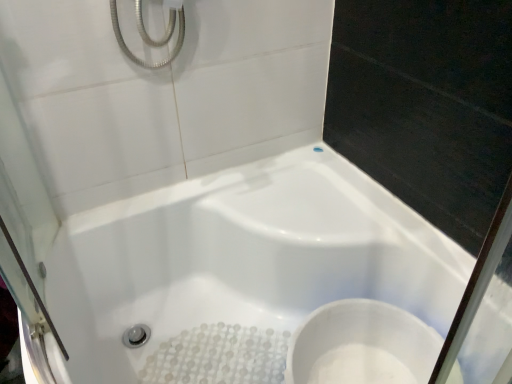
I want to click on white glossy toilet at lower right, so click(x=362, y=345).

Image resolution: width=512 pixels, height=384 pixels. Describe the element at coordinates (362, 345) in the screenshot. I see `white glossy toilet at lower right` at that location.

Locate an element on the screen. This screenshot has height=384, width=512. white glossy bathtub at center is located at coordinates (240, 260).

The height and width of the screenshot is (384, 512). What do you see at coordinates (240, 260) in the screenshot?
I see `white glossy bathtub at center` at bounding box center [240, 260].

In order to click on white glossy toilet at lower right in this screenshot , I will do `click(362, 345)`.

In the image, is white glossy toilet at lower right on the left side or the right side of white glossy bathtub at center?

white glossy toilet at lower right is to the right of white glossy bathtub at center.

Is white glossy toilet at lower right in front of or behind white glossy bathtub at center in the image?

Clearly, white glossy toilet at lower right is behind white glossy bathtub at center.

Considering the points (330, 362) and (298, 159), which point is behind, point (330, 362) or point (298, 159)?

Positioned behind is point (298, 159).

From the image's perspective, which is below, white glossy toilet at lower right or white glossy bathtub at center?

→ white glossy toilet at lower right appears lower in the image.

From a real-world perspective, is white glossy toilet at lower right physically located above or below white glossy bathtub at center?

Clearly, from a real-world perspective, white glossy toilet at lower right is above white glossy bathtub at center.

Based on the photo, considering the sizes of objects white glossy toilet at lower right and white glossy bathtub at center in the image provided, who is thinner, white glossy toilet at lower right or white glossy bathtub at center?

Thinner between the two is white glossy toilet at lower right.

Between white glossy toilet at lower right and white glossy bathtub at center, which one has more height?

Standing taller between the two is white glossy bathtub at center.

Considering the relative sizes of white glossy toilet at lower right and white glossy bathtub at center in the image provided, is white glossy toilet at lower right smaller than white glossy bathtub at center?

Yes.

From the picture: Is white glossy toilet at lower right located outside white glossy bathtub at center?

No, white glossy toilet at lower right is inside white glossy bathtub at center's boundary.

Is the surface of white glossy toilet at lower right in direct contact with white glossy bathtub at center?

No, white glossy toilet at lower right is not beside white glossy bathtub at center.

Could you tell me if white glossy toilet at lower right is facing white glossy bathtub at center?

Yes, white glossy toilet at lower right is oriented towards white glossy bathtub at center.

How many degrees apart are the facing directions of white glossy toilet at lower right and white glossy bathtub at center?

The facing directions of white glossy toilet at lower right and white glossy bathtub at center are 0.459 degrees apart.

At what (x,y) coordinates should I click in order to perform the action: click on toilet on the right of white glossy bathtub at center. Please return your answer as a coordinate pair (x, y). Image resolution: width=512 pixels, height=384 pixels. Looking at the image, I should click on (362, 345).

Consider the image. Visually, is white glossy bathtub at center positioned to the left or to the right of white glossy toilet at lower right?

Clearly, white glossy bathtub at center is on the left of white glossy toilet at lower right in the image.

Which is behind, white glossy bathtub at center or white glossy toilet at lower right?

Positioned behind is white glossy toilet at lower right.

Which is farther from the camera, (170, 198) or (375, 313)?

Point (170, 198)

From the image's perspective, is white glossy bathtub at center located above white glossy toilet at lower right?

Yes, from the image's perspective, white glossy bathtub at center is above white glossy toilet at lower right.

From a real-world perspective, is white glossy bathtub at center physically located above or below white glossy toilet at lower right?

Clearly, from a real-world perspective, white glossy bathtub at center is below white glossy toilet at lower right.

Looking at their sizes, would you say white glossy bathtub at center is wider or thinner than white glossy toilet at lower right?

Considering their sizes, white glossy bathtub at center looks broader than white glossy toilet at lower right.

Does white glossy bathtub at center have a lesser height compared to white glossy toilet at lower right?

No.

Is white glossy bathtub at center smaller than white glossy toilet at lower right?

Actually, white glossy bathtub at center might be larger than white glossy toilet at lower right.

Is white glossy toilet at lower right inside white glossy bathtub at center?

Yes.

Is white glossy bathtub at center beside white glossy toilet at lower right?

No, white glossy bathtub at center is not with white glossy toilet at lower right.

Does white glossy bathtub at center turn towards white glossy toilet at lower right?

No, white glossy bathtub at center is not facing towards white glossy toilet at lower right.

What's the angular difference between white glossy bathtub at center and white glossy toilet at lower right's facing directions?

The angular difference between white glossy bathtub at center and white glossy toilet at lower right is 0.459 degrees.

Measure the distance from white glossy bathtub at center to white glossy toilet at lower right.

The distance of white glossy bathtub at center from white glossy toilet at lower right is 10.10 inches.

I want to click on bathtub lying above the white glossy toilet at lower right (from the image's perspective), so click(240, 260).

You are a GUI agent. You are given a task and a screenshot of the screen. Output one action in this format:
    pyautogui.click(x=<x>, y=<y>)
    Task: Click on the bathtub on the left side of white glossy toilet at lower right
    The height and width of the screenshot is (384, 512).
    Given the screenshot: What is the action you would take?
    pyautogui.click(x=240, y=260)

The height and width of the screenshot is (384, 512). Find the location of `toilet below the white glossy bathtub at center (from the image's perspective)`. toilet below the white glossy bathtub at center (from the image's perspective) is located at coordinates (362, 345).